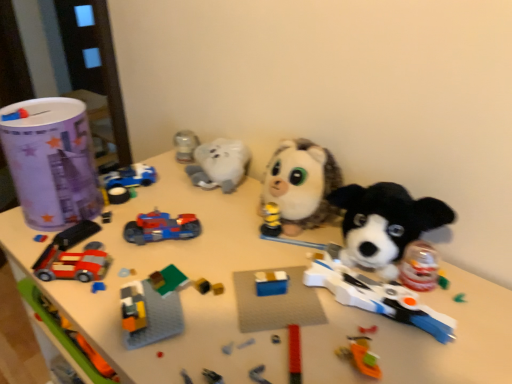
Where is `vacant area that lies in front of shiny plastic toy car at center, which is counted as the second toy, starting from the right`? vacant area that lies in front of shiny plastic toy car at center, which is counted as the second toy, starting from the right is located at coordinates (157, 290).